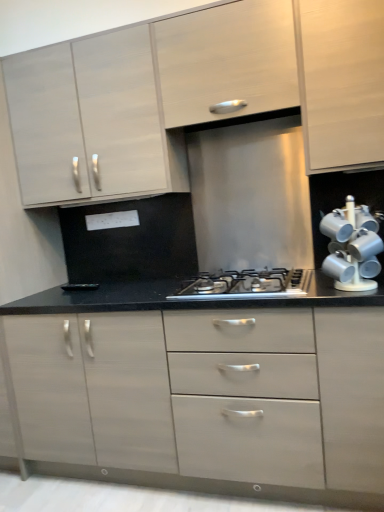
Where is `white glossy mug rack at right`? The height and width of the screenshot is (512, 384). white glossy mug rack at right is located at coordinates (352, 247).

The height and width of the screenshot is (512, 384). What do you see at coordinates (246, 285) in the screenshot? I see `satin silver gas stove at center` at bounding box center [246, 285].

You are a GUI agent. You are given a task and a screenshot of the screen. Output one action in this format:
    pyautogui.click(x=<x>, y=<y>)
    Task: Click on the matte white cabinet at upper left, which appears as the second cabinetry when viewed from the top
    
    Given the screenshot: What is the action you would take?
    pyautogui.click(x=91, y=120)

This screenshot has height=512, width=384. I want to click on matte white drawer at center, the first cabinetry from the bottom, so click(205, 397).

The width and height of the screenshot is (384, 512). Identify the location of white glossy mug rack at right. (352, 247).

Considering the relative sizes of matte white cabinet at upper left, which appears as the second cabinetry when viewed from the top, and white glossy mug rack at right in the image provided, is matte white cabinet at upper left, which appears as the second cabinetry when viewed from the top, shorter than white glossy mug rack at right?

No.

Is matte white cabinet at upper left, which appears as the second cabinetry when viewed from the top, aimed at white glossy mug rack at right?

No, matte white cabinet at upper left, which appears as the second cabinetry when viewed from the top, is not facing towards white glossy mug rack at right.

Consider the image. Is white glossy mug rack at right a part of matte white cabinet at upper left, acting as the second cabinetry starting from the bottom?

No, white glossy mug rack at right is not a part of matte white cabinet at upper left, acting as the second cabinetry starting from the bottom.

From a real-world perspective, which object stands above the other?

From a 3D spatial view, matte white cabinet at upper left, which appears as the second cabinetry when viewed from the top, is above.

Is satin silver gas stove at center not inside white glossy mug rack at right?

Yes, satin silver gas stove at center is located beyond the bounds of white glossy mug rack at right.

Is satin silver gas stove at center facing towards white glossy mug rack at right?

No, satin silver gas stove at center is not oriented towards white glossy mug rack at right.

In terms of height, does matte white cabinet at upper left, which appears as the second cabinetry when viewed from the top, look taller or shorter compared to matte white drawer at center, the first cabinetry from the bottom?

Considering their sizes, matte white cabinet at upper left, which appears as the second cabinetry when viewed from the top, has less height than matte white drawer at center, the first cabinetry from the bottom.

Considering their positions, is matte white cabinet at upper left, acting as the second cabinetry starting from the bottom, located in front of or behind matte white drawer at center, the first cabinetry from the bottom?

Visually, matte white cabinet at upper left, acting as the second cabinetry starting from the bottom, is located behind matte white drawer at center, the first cabinetry from the bottom.

Based on the photo, from the image's perspective, is matte white cabinet at upper left, which appears as the second cabinetry when viewed from the top, over matte white drawer at center, the 3th cabinetry from the top?

Indeed, from the image's perspective, matte white cabinet at upper left, which appears as the second cabinetry when viewed from the top, is shown above matte white drawer at center, the 3th cabinetry from the top.

Image resolution: width=384 pixels, height=512 pixels. Find the location of `the 1st cabinetry to the right when counting from the matte white cabinet at upper left, acting as the second cabinetry starting from the bottom`. the 1st cabinetry to the right when counting from the matte white cabinet at upper left, acting as the second cabinetry starting from the bottom is located at coordinates (205, 397).

Is the surface of matte white cabinet at upper center, which is the 1th cabinetry from top to bottom, in direct contact with satin silver gas stove at center?

No, matte white cabinet at upper center, which is the 1th cabinetry from top to bottom, is not next to satin silver gas stove at center.

Between matte white cabinet at upper center, the third cabinetry when ordered from bottom to top, and satin silver gas stove at center, which one appears on the left side from the viewer's perspective?

matte white cabinet at upper center, the third cabinetry when ordered from bottom to top, is more to the left.

From a real-world perspective, relative to satin silver gas stove at center, is matte white cabinet at upper center, the third cabinetry when ordered from bottom to top, vertically above or below?

matte white cabinet at upper center, the third cabinetry when ordered from bottom to top, is situated higher than satin silver gas stove at center in the real world.

This screenshot has width=384, height=512. I want to click on gas stove located below the white glossy mug rack at right (from the image's perspective), so click(246, 285).

Is white glossy mug rack at right completely or partially outside of satin silver gas stove at center?

Indeed, white glossy mug rack at right is completely outside satin silver gas stove at center.

Is white glossy mug rack at right bigger than satin silver gas stove at center?

Incorrect, white glossy mug rack at right is not larger than satin silver gas stove at center.

Is white glossy mug rack at right wider or thinner than satin silver gas stove at center?

Clearly, white glossy mug rack at right has less width compared to satin silver gas stove at center.

Find the location of a particular element. The height and width of the screenshot is (512, 384). cabinetry behind the matte white cabinet at upper center, which is the 1th cabinetry from top to bottom is located at coordinates (91, 120).

In the image, is matte white cabinet at upper center, which is the 1th cabinetry from top to bottom, positioned in front of or behind matte white cabinet at upper left, acting as the second cabinetry starting from the bottom?

In the image, matte white cabinet at upper center, which is the 1th cabinetry from top to bottom, appears in front of matte white cabinet at upper left, acting as the second cabinetry starting from the bottom.

Considering the sizes of matte white cabinet at upper center, which is the 1th cabinetry from top to bottom, and matte white cabinet at upper left, acting as the second cabinetry starting from the bottom, in the image, is matte white cabinet at upper center, which is the 1th cabinetry from top to bottom, taller or shorter than matte white cabinet at upper left, acting as the second cabinetry starting from the bottom,?

Considering their sizes, matte white cabinet at upper center, which is the 1th cabinetry from top to bottom, has less height than matte white cabinet at upper left, acting as the second cabinetry starting from the bottom.

From the image's perspective, would you say matte white cabinet at upper center, which is the 1th cabinetry from top to bottom, is positioned over matte white cabinet at upper left, which appears as the second cabinetry when viewed from the top?

Yes, from the image's perspective, matte white cabinet at upper center, which is the 1th cabinetry from top to bottom, is above matte white cabinet at upper left, which appears as the second cabinetry when viewed from the top.

Relative to matte white cabinet at upper center, which is the 1th cabinetry from top to bottom, is satin silver gas stove at center in front or behind?

satin silver gas stove at center is in front of matte white cabinet at upper center, which is the 1th cabinetry from top to bottom.

Is satin silver gas stove at center turned away from matte white cabinet at upper center, which is the 1th cabinetry from top to bottom?

Answer: satin silver gas stove at center does not have its back to matte white cabinet at upper center, which is the 1th cabinetry from top to bottom.

Is satin silver gas stove at center placed right next to matte white cabinet at upper center, which is the 1th cabinetry from top to bottom?

They are not placed beside each other.

Find the location of a particular element. This screenshot has width=384, height=512. cabinetry that is the 1st object located above the white glossy mug rack at right (from the image's perspective) is located at coordinates (91, 120).

This screenshot has width=384, height=512. What are the coordinates of `gas stove located behind the white glossy mug rack at right` in the screenshot? It's located at (246, 285).

Considering their positions, is matte white drawer at center, the 3th cabinetry from the top, positioned closer to satin silver gas stove at center than matte white cabinet at upper center, which is the 1th cabinetry from top to bottom?

The object closer to satin silver gas stove at center is matte white drawer at center, the 3th cabinetry from the top.

Estimate the real-world distances between objects in this image. Which object is closer to matte white cabinet at upper center, the third cabinetry when ordered from bottom to top, satin silver gas stove at center or white glossy mug rack at right?

Among the two, white glossy mug rack at right is located nearer to matte white cabinet at upper center, the third cabinetry when ordered from bottom to top.

Estimate the real-world distances between objects in this image. Which object is closer to matte white cabinet at upper left, acting as the second cabinetry starting from the bottom, satin silver gas stove at center or white glossy mug rack at right?

Among the two, satin silver gas stove at center is located nearer to matte white cabinet at upper left, acting as the second cabinetry starting from the bottom.

Which object lies further to the anchor point white glossy mug rack at right, satin silver gas stove at center or matte white cabinet at upper left, which appears as the second cabinetry when viewed from the top?

matte white cabinet at upper left, which appears as the second cabinetry when viewed from the top.

When comparing their distances from matte white cabinet at upper left, acting as the second cabinetry starting from the bottom, does matte white cabinet at upper center, the third cabinetry when ordered from bottom to top, or matte white drawer at center, the 3th cabinetry from the top, seem closer?

matte white cabinet at upper center, the third cabinetry when ordered from bottom to top, is positioned closer to the anchor matte white cabinet at upper left, acting as the second cabinetry starting from the bottom.

Estimate the real-world distances between objects in this image. Which object is further from matte white drawer at center, the first cabinetry from the bottom, matte white cabinet at upper center, the third cabinetry when ordered from bottom to top, or matte white cabinet at upper left, which appears as the second cabinetry when viewed from the top?

matte white cabinet at upper center, the third cabinetry when ordered from bottom to top, is positioned further to the anchor matte white drawer at center, the first cabinetry from the bottom.

Looking at the image, which one is located further to white glossy mug rack at right, matte white cabinet at upper center, the third cabinetry when ordered from bottom to top, or matte white cabinet at upper left, acting as the second cabinetry starting from the bottom?

matte white cabinet at upper left, acting as the second cabinetry starting from the bottom, is positioned further to the anchor white glossy mug rack at right.

Based on their spatial positions, is matte white cabinet at upper left, which appears as the second cabinetry when viewed from the top, or satin silver gas stove at center closer to matte white drawer at center, the 3th cabinetry from the top?

satin silver gas stove at center is positioned closer to the anchor matte white drawer at center, the 3th cabinetry from the top.

Identify the location of cabinetry that lies between matte white cabinet at upper center, the third cabinetry when ordered from bottom to top, and satin silver gas stove at center from top to bottom. (91, 120).

The image size is (384, 512). In order to click on gas stove between matte white cabinet at upper left, which appears as the second cabinetry when viewed from the top, and matte white drawer at center, the first cabinetry from the bottom, vertically in this screenshot , I will do `click(246, 285)`.

You are a GUI agent. You are given a task and a screenshot of the screen. Output one action in this format:
    pyautogui.click(x=<x>, y=<y>)
    Task: Click on the gas stove between white glossy mug rack at right and matte white drawer at center, the 3th cabinetry from the top, from top to bottom
    The width and height of the screenshot is (384, 512).
    Given the screenshot: What is the action you would take?
    pyautogui.click(x=246, y=285)

Locate an element on the screen. cabinetry between matte white cabinet at upper center, which is the 1th cabinetry from top to bottom, and matte white drawer at center, the 3th cabinetry from the top, from top to bottom is located at coordinates (91, 120).